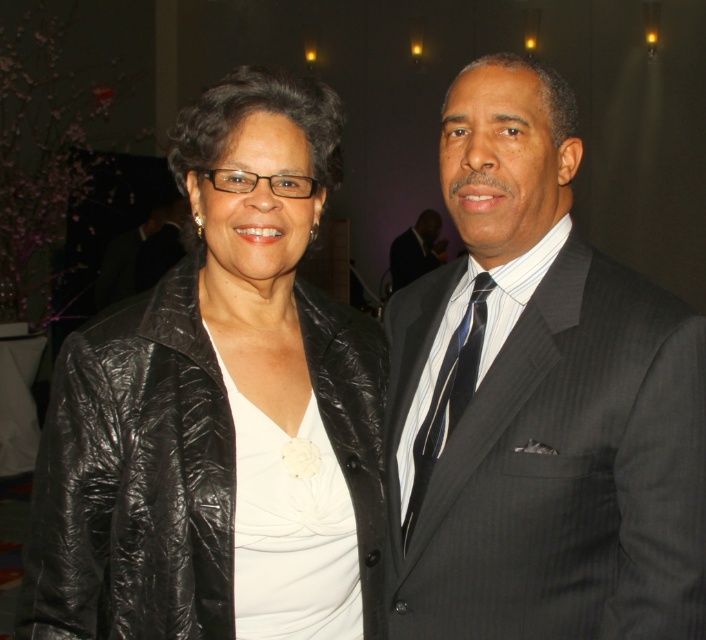
Question: Can you confirm if black leather jacket at left is positioned below striped silk tie at right?

Choices:
 (A) no
 (B) yes

Answer: (A)

Question: Does black leather jacket at left appear under dark gray pinstripe suit at right?

Choices:
 (A) yes
 (B) no

Answer: (A)

Question: Is dark gray pinstripe suit at right closer to camera compared to striped silk tie at right?

Choices:
 (A) no
 (B) yes

Answer: (B)

Question: Which of the following is the farthest from the observer?

Choices:
 (A) (306, 531)
 (B) (424, 236)
 (C) (397, 452)

Answer: (B)

Question: Among these points, which one is farthest from the camera?

Choices:
 (A) (436, 244)
 (B) (429, 474)

Answer: (A)

Question: Which point is farther from the camera taking this photo?

Choices:
 (A) (566, 541)
 (B) (426, 224)
 (C) (441, 396)

Answer: (B)